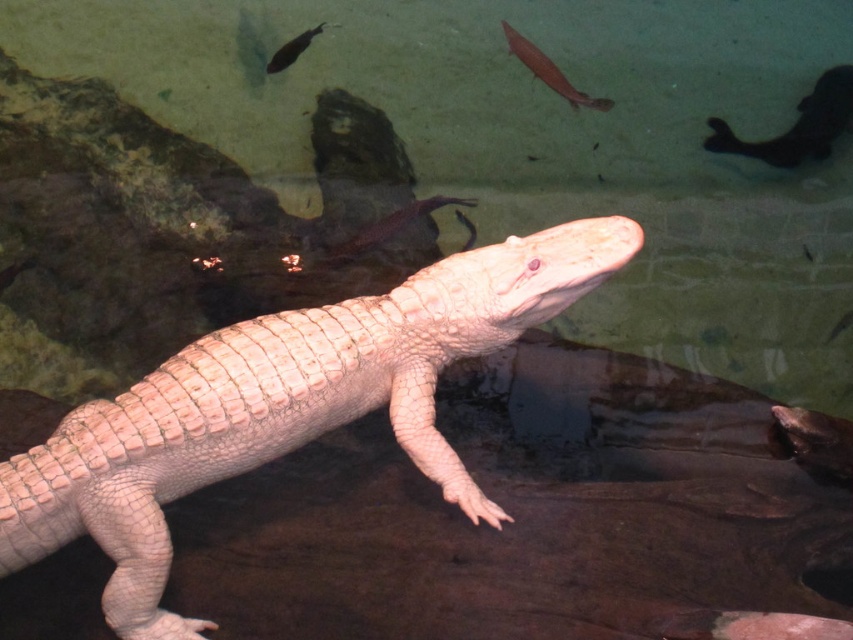
You are an underwater photographer aiming to capture a closeup of the shiny silver fish at upper center and the shiny black fish at upper left. Which fish should you focus on first to ensure it appears sharp in your photo?

You should focus on the shiny silver fish at upper center first since it is closer to the viewer than the shiny black fish at upper left, ensuring it stays sharp before adjusting focus for the other fish.

Consider the image. You are an underwater photographer trying to capture the albino alligator and the two fish in the aquarium. You want to frame your shot so that the shiny silver fish at upper center and the shiny black fish at upper left are both visible. Which fish should you position closer to the top of the frame to ensure both are in the shot?

The shiny silver fish at upper center is much taller than the shiny black fish at upper left. To ensure both are visible in the shot, position the shiny silver fish at upper center closer to the top of the frame so its height doesn